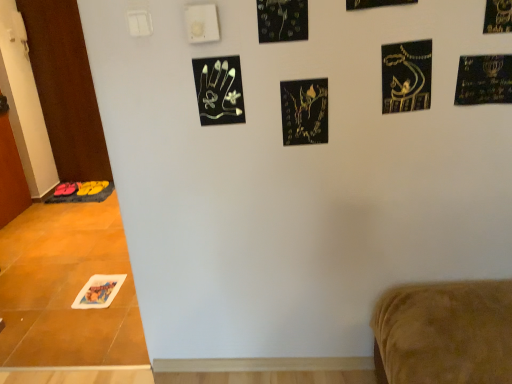
Question: Considering the relative sizes of white glossy door at left, which is the 2th door in back-to-front order, and black matte print at center, marked as the fifth print in a top-to-bottom arrangement, in the image provided, is white glossy door at left, which is the 2th door in back-to-front order, smaller than black matte print at center, marked as the fifth print in a top-to-bottom arrangement,?

Choices:
 (A) yes
 (B) no

Answer: (B)

Question: Can you see white glossy door at left, the first door viewed from the front, touching black matte print at center, placed as the 5th print when sorted from front to back?

Choices:
 (A) no
 (B) yes

Answer: (A)

Question: Is white glossy door at left, which is the 2th door in back-to-front order, facing away from black matte print at center, placed as the second print when sorted from back to front?

Choices:
 (A) no
 (B) yes

Answer: (A)

Question: Is white glossy door at left, the first door viewed from the front, wider than black matte print at center, placed as the 5th print when sorted from front to back?

Choices:
 (A) yes
 (B) no

Answer: (A)

Question: Does white glossy door at left, which is the 2th door in back-to-front order, have a lesser width compared to black matte print at center, the 4th print when ordered from left to right?

Choices:
 (A) no
 (B) yes

Answer: (A)

Question: Can you confirm if white glossy door at left, the first door viewed from the front, is positioned to the left of black matte print at center, the third print when ordered from right to left?

Choices:
 (A) no
 (B) yes

Answer: (B)

Question: Does printed paper at lower left, arranged as the first print when ordered from the bottom, have a lesser width compared to black metallic handprint at upper center, which is counted as the third print, starting from the back?

Choices:
 (A) yes
 (B) no

Answer: (B)

Question: Does printed paper at lower left, which is the sixth print from top to bottom, have a greater width compared to black metallic handprint at upper center, the third print ordered from the bottom?

Choices:
 (A) no
 (B) yes

Answer: (B)

Question: Is printed paper at lower left, the first print positioned from the left, located outside black metallic handprint at upper center, positioned as the 5th print in right-to-left order?

Choices:
 (A) yes
 (B) no

Answer: (A)

Question: Does printed paper at lower left, the sixth print from the right, touch black metallic handprint at upper center, the third print ordered from the bottom?

Choices:
 (A) no
 (B) yes

Answer: (A)

Question: Can you confirm if printed paper at lower left, placed as the first print when sorted from back to front, is taller than black metallic handprint at upper center, the third print ordered from the bottom?

Choices:
 (A) no
 (B) yes

Answer: (A)

Question: From the image's perspective, is printed paper at lower left, positioned as the 6th print in front-to-back order, under black metallic handprint at upper center, positioned as the 5th print in right-to-left order?

Choices:
 (A) yes
 (B) no

Answer: (A)

Question: Is brown wood door at left, positioned as the second door in front-to-back order, shorter than black glossy leaves at upper center, the second print positioned from the front?

Choices:
 (A) yes
 (B) no

Answer: (B)